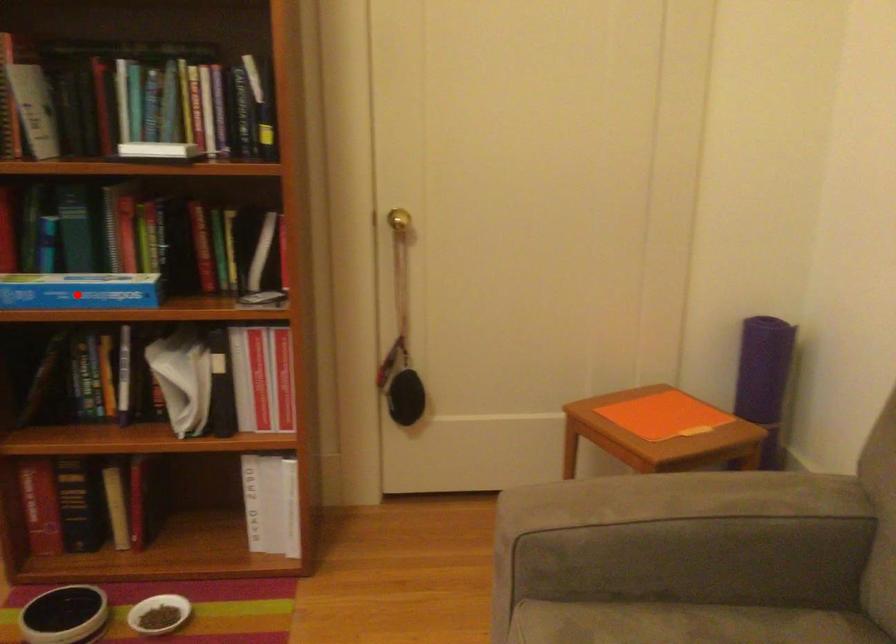
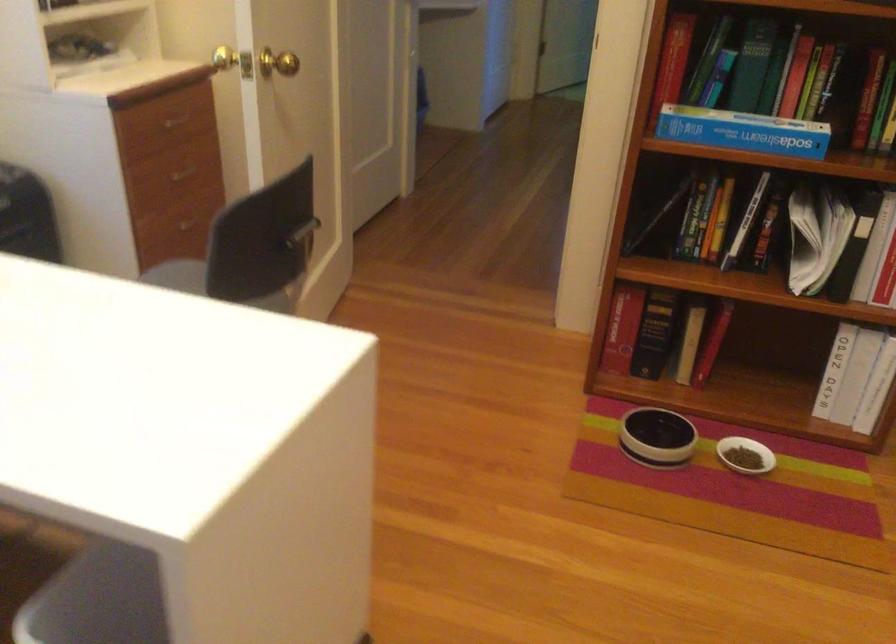
In the second image, find the point that corresponds to the highlighted location in the first image.

(743, 131)